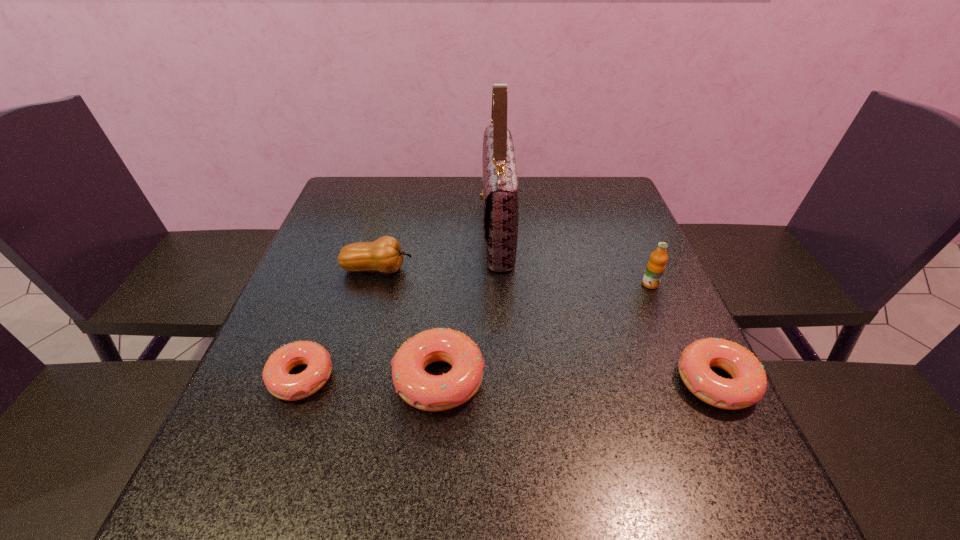
Where is `doughnut that is the third closest to the orange juice`? doughnut that is the third closest to the orange juice is located at coordinates (281, 384).

Where is `free location that satisfies the following two spatial constraints: 1. on the stem side of the gourd; 2. on the front side of the leftmost doughnut`? The image size is (960, 540). free location that satisfies the following two spatial constraints: 1. on the stem side of the gourd; 2. on the front side of the leftmost doughnut is located at coordinates (348, 378).

Where is `free region that satisfies the following two spatial constraints: 1. on the front of the handbag with the clasp; 2. on the left side of the rightmost doughnut`? free region that satisfies the following two spatial constraints: 1. on the front of the handbag with the clasp; 2. on the left side of the rightmost doughnut is located at coordinates (505, 382).